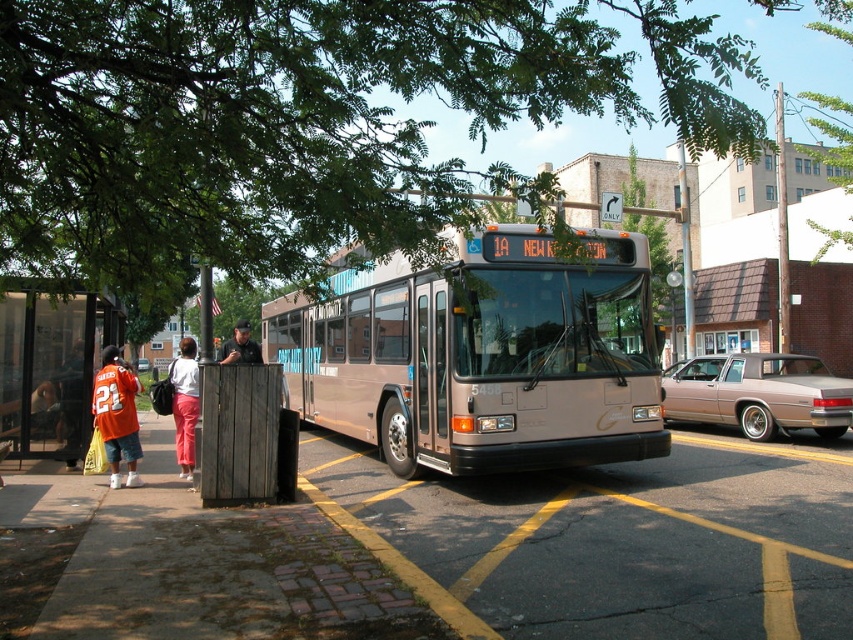
Does gold metallic sedan at right have a smaller size compared to orange jersey at lower left?

No, gold metallic sedan at right is not smaller than orange jersey at lower left.

Which is behind, point (833, 406) or point (113, 420)?

The point (833, 406) is behind.

This screenshot has width=853, height=640. What are the coordinates of `gold metallic sedan at right` in the screenshot? It's located at (758, 394).

Looking at this image, between metallic gold bus at center and transparent plastic bus stop at left, which one has more height?

metallic gold bus at center is taller.

Can you confirm if metallic gold bus at center is taller than transparent plastic bus stop at left?

Yes, metallic gold bus at center is taller than transparent plastic bus stop at left.

Image resolution: width=853 pixels, height=640 pixels. In order to click on metallic gold bus at center in this screenshot , I will do `click(482, 355)`.

Does transparent plastic bus stop at left have a greater width compared to matte pink pants at lower left?

No, transparent plastic bus stop at left is not wider than matte pink pants at lower left.

Which of these two, transparent plastic bus stop at left or matte pink pants at lower left, stands taller?

Standing taller between the two is transparent plastic bus stop at left.

Is point (13, 452) positioned after point (183, 394)?

Yes, it is.

Where is `transparent plastic bus stop at left`? transparent plastic bus stop at left is located at coordinates (51, 368).